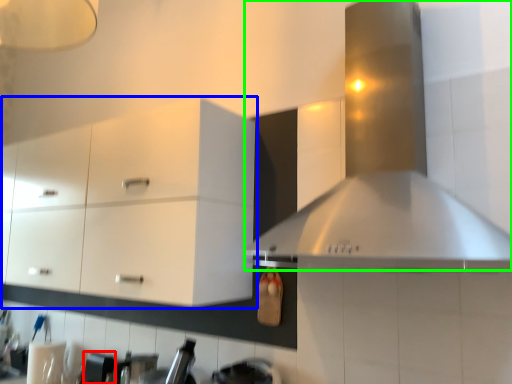
Question: Which object is the farthest from appliance (highlighted by a red box)? Choose among these: cabinetry (highlighted by a blue box) or vent (highlighted by a green box).

Choices:
 (A) cabinetry
 (B) vent

Answer: (B)